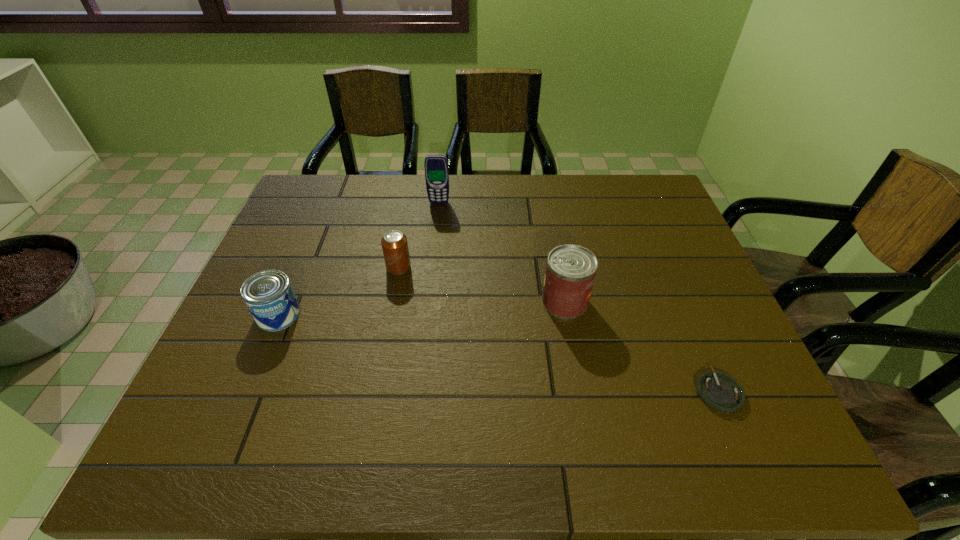
Image resolution: width=960 pixels, height=540 pixels. In order to click on free space between the tallest can and the farthest object in this screenshot , I will do `click(502, 252)`.

The image size is (960, 540). I want to click on empty space that is in between the tallest object and the second object from left to right, so click(419, 235).

Identify the location of vacant space in between the leftmost can and the farthest object. The height and width of the screenshot is (540, 960). (359, 259).

At what (x,y) coordinates should I click in order to perform the action: click on unoccupied area between the nearest object and the leftmost can. Please return your answer as a coordinate pair (x, y). Looking at the image, I should click on (498, 353).

This screenshot has width=960, height=540. In order to click on empty space between the fourth nearest object and the third object from left to right in this screenshot , I will do `click(419, 235)`.

Locate an element on the screen. unoccupied position between the shortest object and the farthest can is located at coordinates (559, 329).

You are a GUI agent. You are given a task and a screenshot of the screen. Output one action in this format:
    pyautogui.click(x=<x>, y=<y>)
    Task: Click on the free point between the farthest can and the leftmost can
    
    Given the screenshot: What is the action you would take?
    pyautogui.click(x=339, y=291)

At what (x,y) coordinates should I click in order to perform the action: click on free space that is in between the nearest object and the leftmost object. Please return your answer as a coordinate pair (x, y). Image resolution: width=960 pixels, height=540 pixels. Looking at the image, I should click on (498, 353).

Locate an element on the screen. The width and height of the screenshot is (960, 540). vacant area that lies between the tallest object and the leftmost can is located at coordinates (359, 259).

Locate which object is the fourth closest to the cellular telephone. Please provide its 2D coordinates. Your answer should be formatted as a tuple, i.e. [(x, y)], where the tuple contains the x and y coordinates of a point satisfying the conditions above.

[(719, 391)]